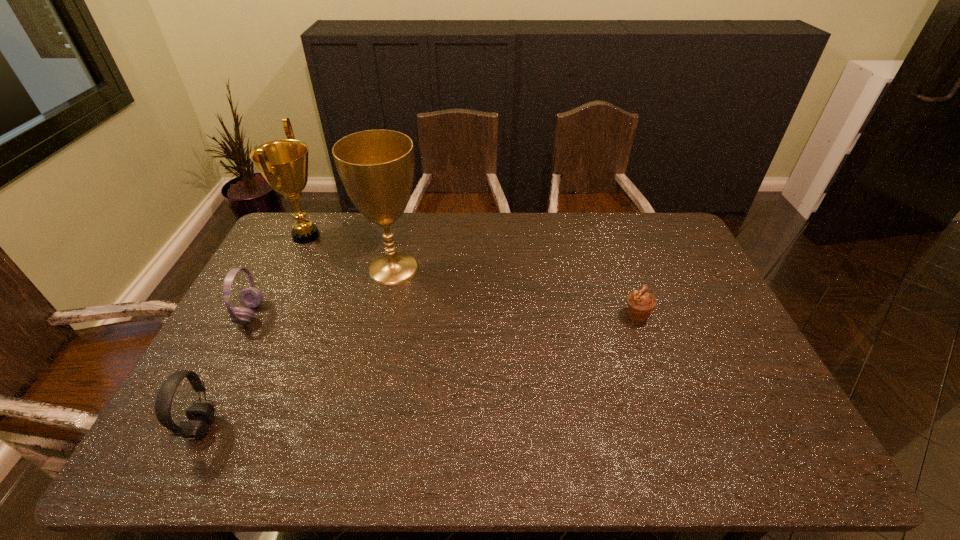
What are the coordinates of `vacant point located between the farther headset and the nearer headset` in the screenshot? It's located at (227, 370).

Locate an element on the screen. This screenshot has height=540, width=960. free space between the second object from right to left and the farther headset is located at coordinates (322, 291).

Identify which object is located as the nearest to the second object from right to left. Please provide its 2D coordinates. Your answer should be formatted as a tuple, i.e. [(x, y)], where the tuple contains the x and y coordinates of a point satisfying the conditions above.

[(283, 163)]

You are a GUI agent. You are given a task and a screenshot of the screen. Output one action in this format:
    pyautogui.click(x=<x>, y=<y>)
    Task: Click on the object that stands as the fourth closest to the nearer headset
    
    Given the screenshot: What is the action you would take?
    pyautogui.click(x=640, y=303)

In order to click on vacant point that satisfies the following two spatial constraints: 1. on the headband and ear cups of the farther headset; 2. on the back side of the muffin in this screenshot , I will do `click(250, 315)`.

The image size is (960, 540). I want to click on free location that satisfies the following two spatial constraints: 1. on the front side of the muffin; 2. on the left side of the trophy cup, so click(383, 315).

You are a GUI agent. You are given a task and a screenshot of the screen. Output one action in this format:
    pyautogui.click(x=<x>, y=<y>)
    Task: Click on the free space that satisfies the following two spatial constraints: 1. on the front side of the shortest object; 2. on the left side of the second object from right to left
    Image resolution: width=960 pixels, height=540 pixels.
    Given the screenshot: What is the action you would take?
    pyautogui.click(x=383, y=315)